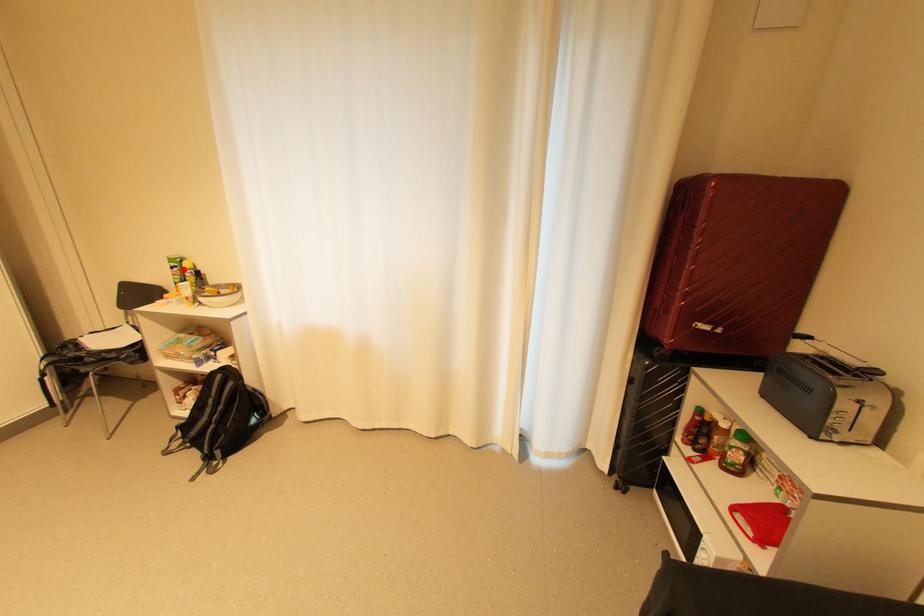
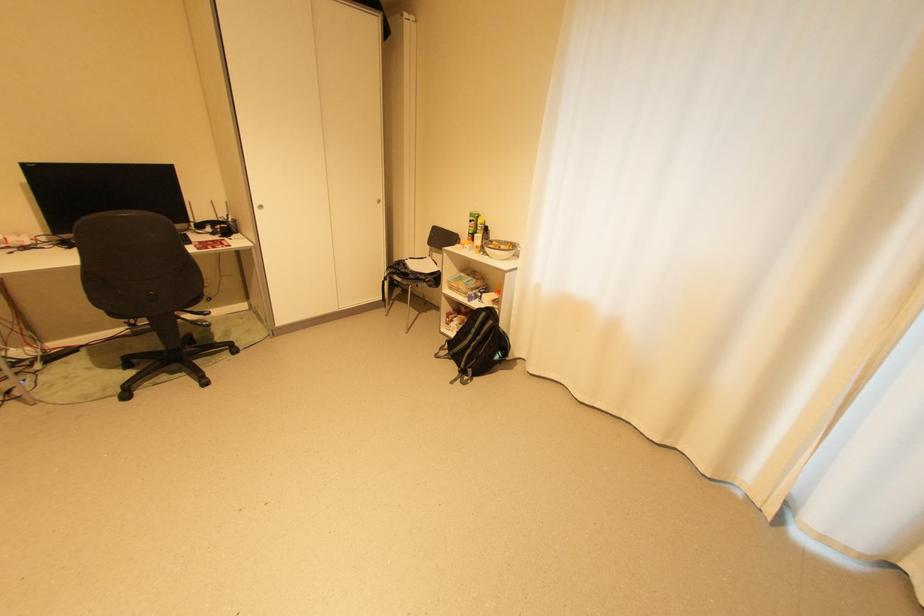
In the second image, find the point that corresponds to the highlighted location in the first image.

(480, 223)